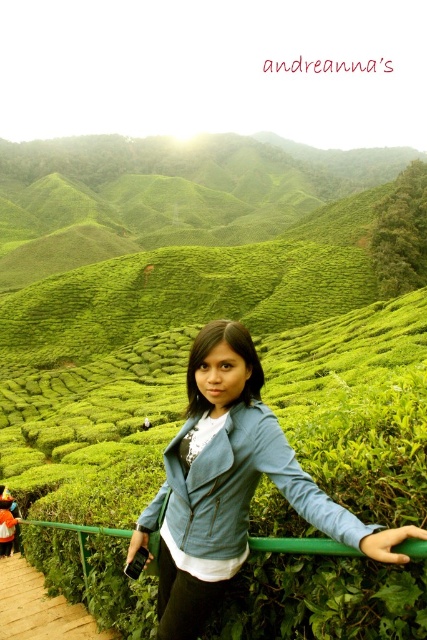
Locate an element on the screen. This screenshot has width=427, height=640. matte blue jacket at center is located at coordinates (231, 484).

Find the location of a particular element. This screenshot has height=640, width=427. matte blue jacket at center is located at coordinates (231, 484).

Does wooden planks at lower left come behind green metal/rail at center?

Yes, it is.

Between wooden planks at lower left and green metal/rail at center, which one is positioned lower?

wooden planks at lower left

Locate an element on the screen. wooden planks at lower left is located at coordinates (38, 608).

Which of these two, matte blue jacket at center or wooden planks at lower left, stands taller?

With more height is matte blue jacket at center.

Locate an element on the screen. The width and height of the screenshot is (427, 640). matte blue jacket at center is located at coordinates (231, 484).